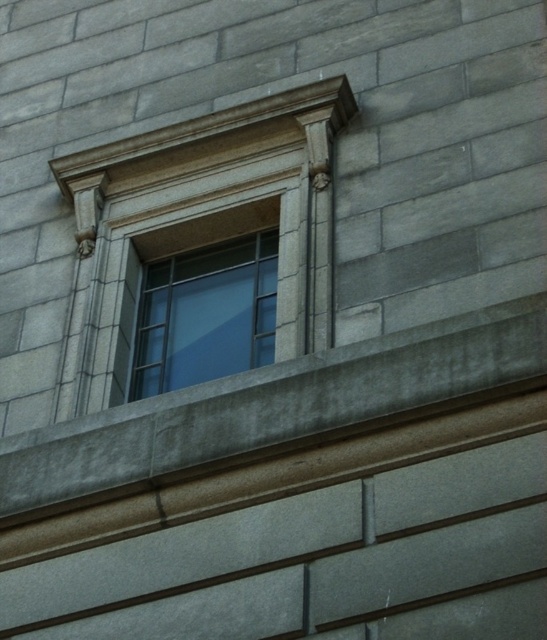
You are an architect designing a new building and want to ensure that the gray stone ledge at center and the clear glass window at center are proportionally balanced. Given their sizes, which object should be placed higher to maintain visual harmony?

The gray stone ledge at center has a smaller size compared to the clear glass window at center, so placing the gray stone ledge at center higher would help balance the visual weight between the two elements.

You are a window cleaner standing on a ladder that is 12 meters tall. You need to clean both the gray stone ledge at center and the clear glass window at center. Can you reach both objects with your current ladder height?

The distance between the gray stone ledge at center and the clear glass window at center is 14.40 meters. Since your ladder is only 12 meters tall, you cannot reach either of them as the required height exceeds the ladder capacity.

You are an architect examining the building facade. You need to determine if the gray stone ledge at center can support a decorative statue that requires a base height of 1.2 meters. Given the clear glass window at center is 3 meters tall, can the ledge accommodate the statue?

The gray stone ledge at center is not as tall as the clear glass window at center, which is 3 meters tall. Since the ledge is shorter than the window, its height is less than 3 meters. However, the exact height of the ledge isn not specified. Without knowing the ledge height, we cannot confirm if it meets the 1.2 meter requirement.